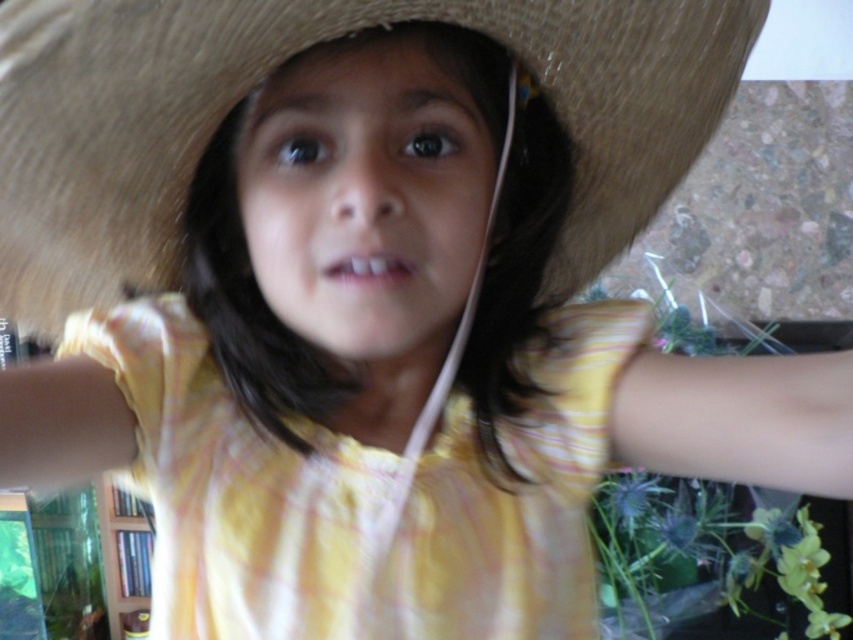
Can you confirm if brown straw hat at center is taller than yellow cotton dress at center?

In fact, brown straw hat at center may be shorter than yellow cotton dress at center.

Which is in front, point (724, 77) or point (467, 440)?

Point (467, 440) is more forward.

Where is `brown straw hat at center`? brown straw hat at center is located at coordinates (279, 64).